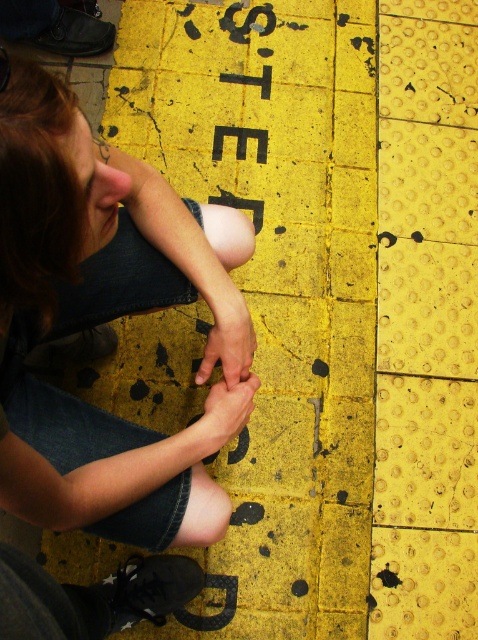
In order to click on denim jeans at center in this screenshot , I will do `click(96, 317)`.

Which is more to the left, denim jeans at center or matte skin hand at center?

denim jeans at center is more to the left.

You are a GUI agent. You are given a task and a screenshot of the screen. Output one action in this format:
    pyautogui.click(x=<x>, y=<y>)
    Task: Click on the denim jeans at center
    Image resolution: width=478 pixels, height=640 pixels.
    Given the screenshot: What is the action you would take?
    pyautogui.click(x=96, y=317)

You are a GUI agent. You are given a task and a screenshot of the screen. Output one action in this format:
    pyautogui.click(x=<x>, y=<y>)
    Task: Click on the denim jeans at center
    The image size is (478, 640).
    Given the screenshot: What is the action you would take?
    pyautogui.click(x=96, y=317)

Is denim jeans at center smaller than black rubber letters at center?

Incorrect, denim jeans at center is not smaller in size than black rubber letters at center.

Which is above, denim jeans at center or black rubber letters at center?

Positioned higher is black rubber letters at center.

Describe the element at coordinates (96, 317) in the screenshot. I see `denim jeans at center` at that location.

This screenshot has width=478, height=640. Find the location of `denim jeans at center`. denim jeans at center is located at coordinates (96, 317).

Which of these two, matte skin hand at center or smooth skin hand at center, stands taller?

With more height is matte skin hand at center.

Does matte skin hand at center have a lesser width compared to smooth skin hand at center?

Indeed, matte skin hand at center has a lesser width compared to smooth skin hand at center.

Identify the location of matte skin hand at center. (228, 344).